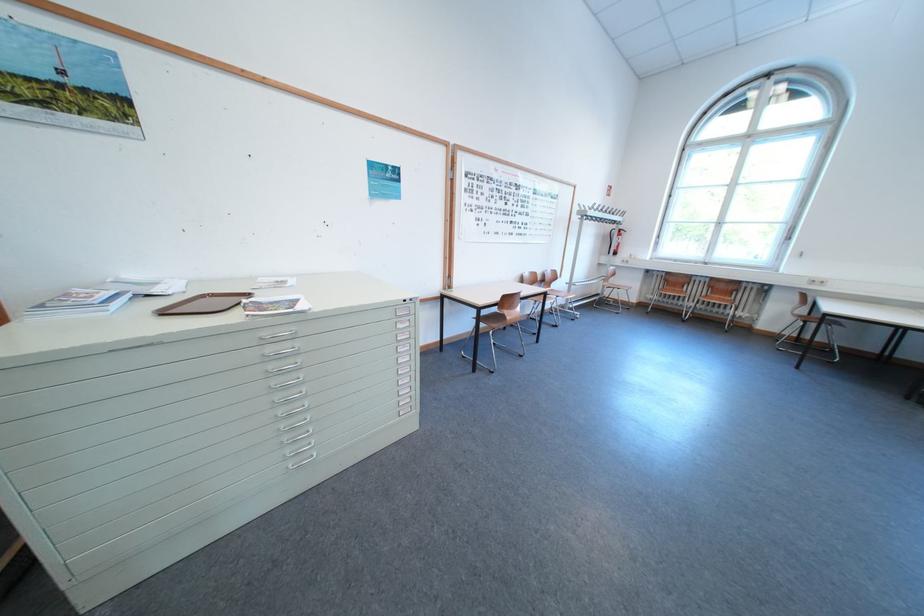
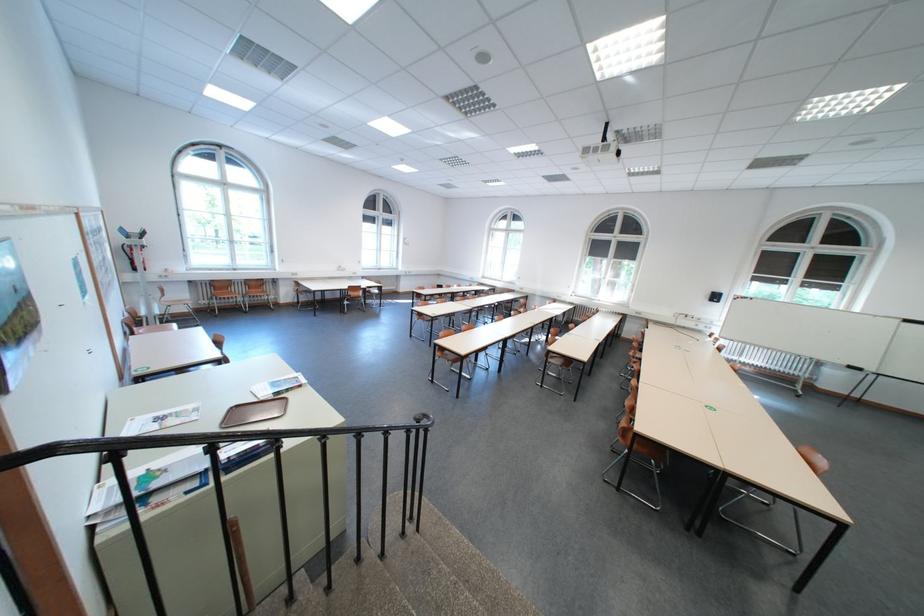
In the second image, find the point that corresponds to the point at 670,285 in the first image.

(219, 292)